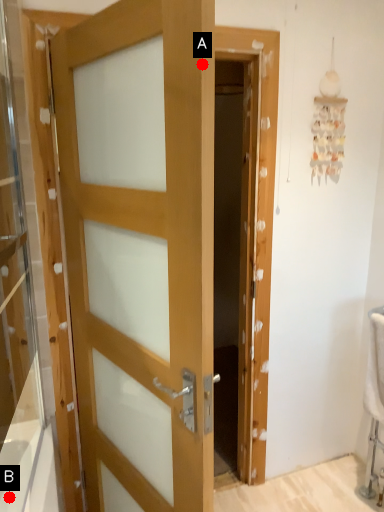
Question: Two points are circled on the image, labeled by A and B beside each circle. Which point is farther to the camera?

Choices:
 (A) A is further
 (B) B is further

Answer: (B)